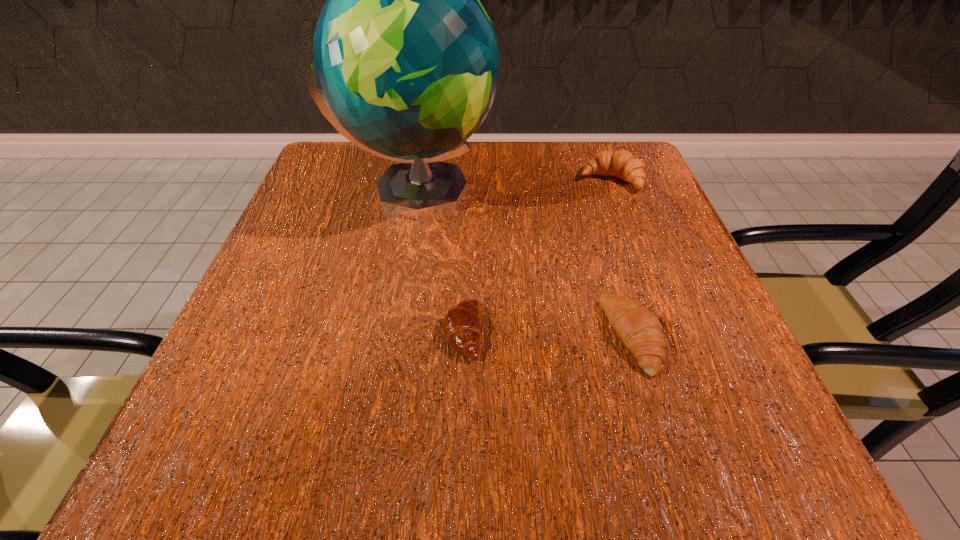
I want to click on globe that is positioned at the far edge, so click(406, 64).

Locate an element on the screen. Image resolution: width=960 pixels, height=540 pixels. crescent roll that is positioned at the far edge is located at coordinates (622, 164).

Where is `object located in the left edge section of the desktop`? object located in the left edge section of the desktop is located at coordinates (406, 64).

This screenshot has width=960, height=540. Find the location of `object that is at the far left corner`. object that is at the far left corner is located at coordinates (406, 64).

The width and height of the screenshot is (960, 540). In order to click on object that is at the far right corner in this screenshot , I will do `click(622, 164)`.

You are a GUI agent. You are given a task and a screenshot of the screen. Output one action in this format:
    pyautogui.click(x=<x>, y=<y>)
    Task: Click on the vacant point at the far edge
    This screenshot has width=960, height=540.
    Given the screenshot: What is the action you would take?
    pyautogui.click(x=517, y=184)

You are a GUI agent. You are given a task and a screenshot of the screen. Output one action in this format:
    pyautogui.click(x=<x>, y=<y>)
    Task: Click on the vacant space at the left edge of the desktop
    The height and width of the screenshot is (540, 960).
    Given the screenshot: What is the action you would take?
    pyautogui.click(x=334, y=251)

You are a GUI agent. You are given a task and a screenshot of the screen. Output one action in this format:
    pyautogui.click(x=<x>, y=<y>)
    Task: Click on the free space at the right edge of the desktop
    
    Given the screenshot: What is the action you would take?
    pyautogui.click(x=647, y=381)

Find the location of a particular element. This screenshot has height=540, width=960. vacant region at the far left corner is located at coordinates (386, 158).

In the image, there is a desktop. Where is `vacant space at the near left corner`? The width and height of the screenshot is (960, 540). vacant space at the near left corner is located at coordinates (204, 449).